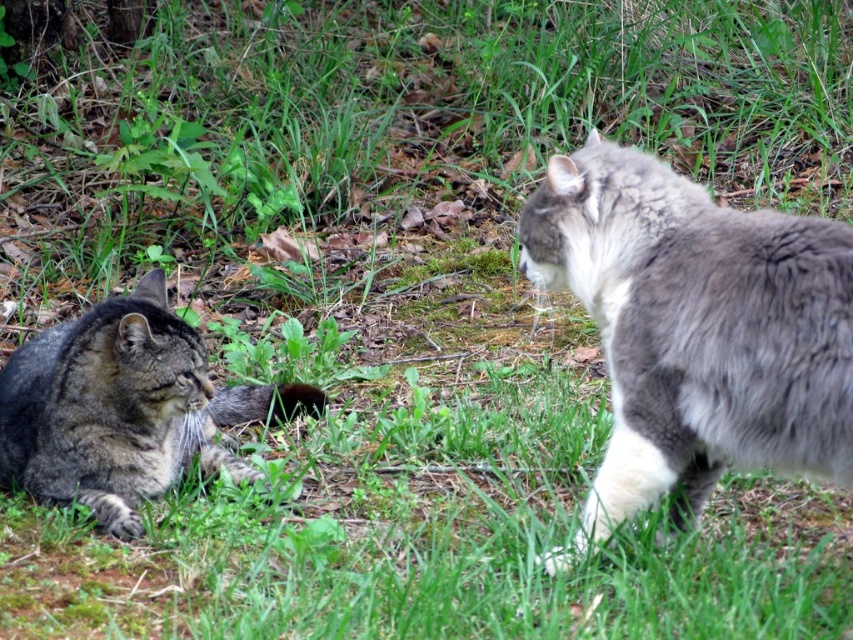
Question: Does gray fluffy cat at right have a lesser width compared to tabby fur cat at left?

Choices:
 (A) yes
 (B) no

Answer: (A)

Question: Can you confirm if gray fluffy cat at right is positioned to the right of tabby fur cat at left?

Choices:
 (A) no
 (B) yes

Answer: (B)

Question: Does gray fluffy cat at right appear on the right side of tabby fur cat at left?

Choices:
 (A) no
 (B) yes

Answer: (B)

Question: Which point appears closest to the camera in this image?

Choices:
 (A) (814, 230)
 (B) (71, 349)

Answer: (A)